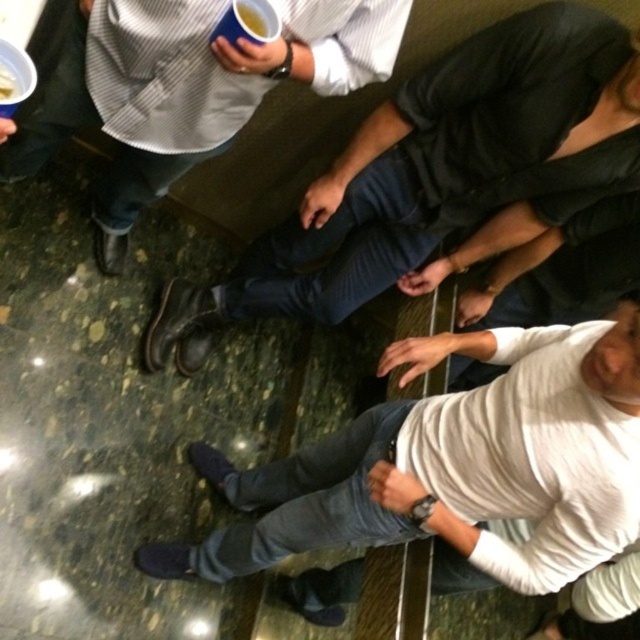
Who is shorter, dark brown leather shoes at lower left or striped cotton shirt at upper center?

With less height is striped cotton shirt at upper center.

The height and width of the screenshot is (640, 640). I want to click on dark brown leather shoes at lower left, so click(440, 177).

Can you confirm if dark brown leather shoes at lower left is thinner than blue paper cup at upper center?

No, dark brown leather shoes at lower left is not thinner than blue paper cup at upper center.

Who is higher up, dark brown leather shoes at lower left or blue paper cup at upper center?

blue paper cup at upper center

This screenshot has height=640, width=640. What do you see at coordinates (440, 177) in the screenshot?
I see `dark brown leather shoes at lower left` at bounding box center [440, 177].

Locate an element on the screen. dark brown leather shoes at lower left is located at coordinates (440, 177).

Does striped cotton shirt at upper center have a greater height compared to white paper cup at upper left?

Yes.

Describe the element at coordinates (188, 88) in the screenshot. The width and height of the screenshot is (640, 640). I see `striped cotton shirt at upper center` at that location.

What are the coordinates of `striped cotton shirt at upper center` in the screenshot? It's located at (188, 88).